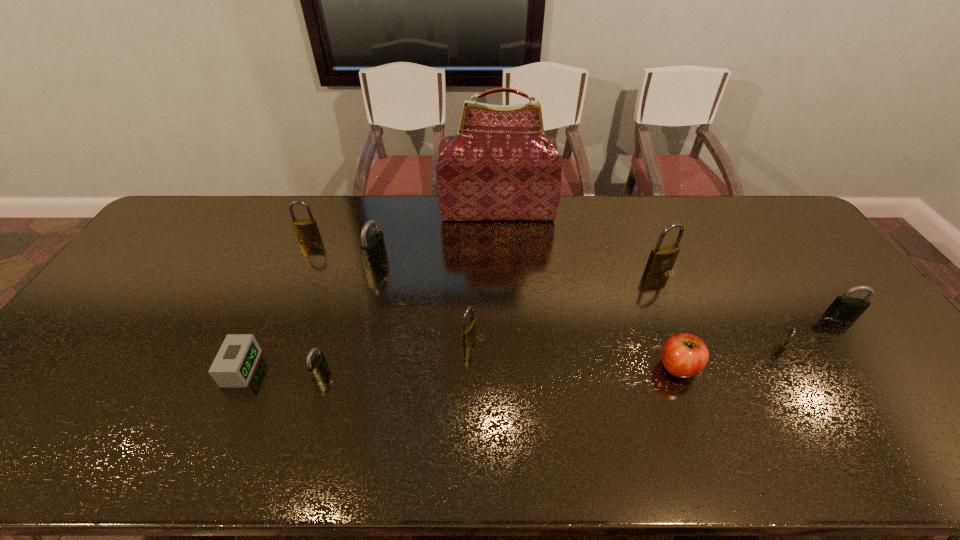
Image resolution: width=960 pixels, height=540 pixels. I want to click on free space located 0.330m on the left of the farthest black padlock, so click(x=263, y=260).

Identify the location of vacant point located 0.120m on the left of the second farthest object. (263, 238).

You are a GUI agent. You are given a task and a screenshot of the screen. Output one action in this format:
    pyautogui.click(x=<x>, y=<y>)
    Task: Click on the free region located on the front of the second nearest black padlock
    The image size is (960, 540).
    Given the screenshot: What is the action you would take?
    pyautogui.click(x=876, y=363)

Identify the location of free space located 0.180m on the left of the second brass padlock from left to right. (395, 338).

Where is `vacant space located on the back of the apple`? This screenshot has width=960, height=540. vacant space located on the back of the apple is located at coordinates (637, 258).

The image size is (960, 540). I want to click on vacant space located on the right of the smallest black padlock, so click(468, 373).

The height and width of the screenshot is (540, 960). Identify the location of vacant area located 0.320m on the left of the second padlock from right to left. (650, 351).

Identify the location of blank area located 0.260m on the front-facing side of the alarm clock. tap(357, 368).

I want to click on handbag that is at the far edge, so click(x=500, y=166).

Find the location of a particular element. padlock present at the far edge is located at coordinates (306, 229).